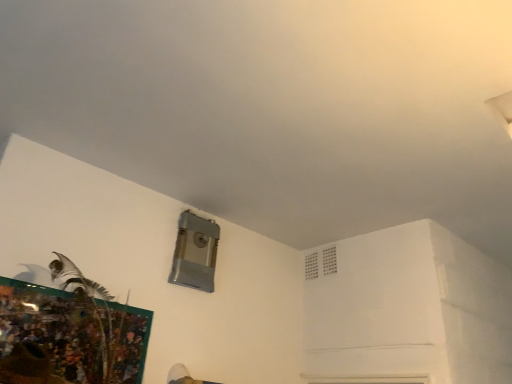
Question: In the image, is white plastic air conditioning at upper right positioned in front of or behind metallic textured picture frame at lower left?

Choices:
 (A) front
 (B) behind

Answer: (B)

Question: In terms of height, does white plastic air conditioning at upper right look taller or shorter compared to metallic textured picture frame at lower left?

Choices:
 (A) tall
 (B) short

Answer: (B)

Question: Choose the correct answer: Is white plastic air conditioning at upper right inside metallic textured picture frame at lower left or outside it?

Choices:
 (A) outside
 (B) inside

Answer: (A)

Question: From the image's perspective, relative to white plastic air conditioning at upper right, is metallic textured picture frame at lower left above or below?

Choices:
 (A) below
 (B) above

Answer: (A)

Question: Is point (56, 339) closer or farther from the camera than point (307, 274)?

Choices:
 (A) closer
 (B) farther

Answer: (A)

Question: Considering their positions, is metallic textured picture frame at lower left located in front of or behind white plastic air conditioning at upper right?

Choices:
 (A) front
 (B) behind

Answer: (A)

Question: Looking at the image, does metallic textured picture frame at lower left seem bigger or smaller compared to white plastic air conditioning at upper right?

Choices:
 (A) big
 (B) small

Answer: (A)